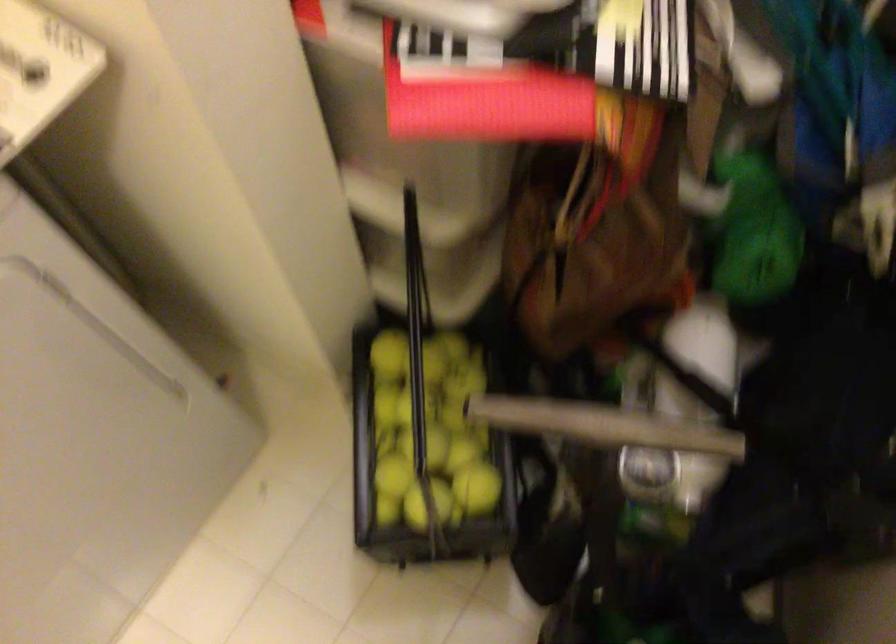
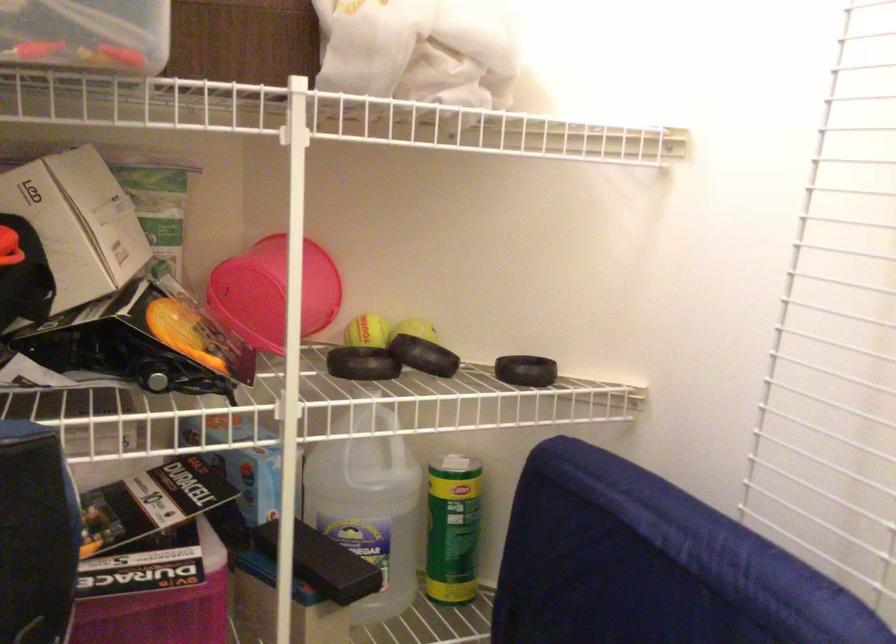
First-person continuous shooting, in which direction is the camera rotating?

The rotation direction of the camera is right-up.